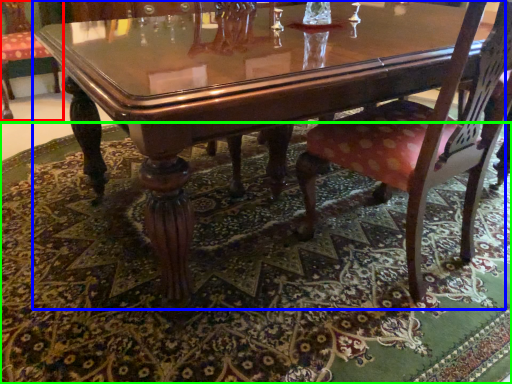
Question: Based on their relative distances, which object is nearer to chair (highlighted by a red box)? Choose from coffee table (highlighted by a blue box) and place mat (highlighted by a green box).

Choices:
 (A) coffee table
 (B) place mat

Answer: (B)